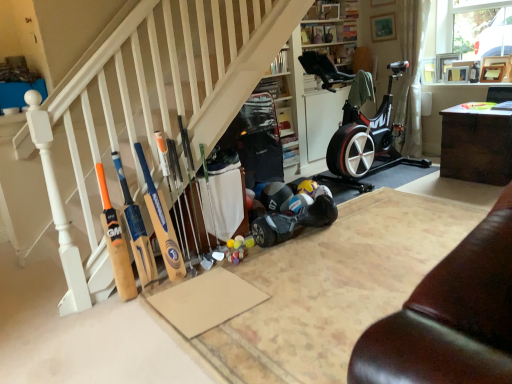
Question: Is dark wood table at right bigger or smaller than wooden cricket bats at lower left?

Choices:
 (A) big
 (B) small

Answer: (B)

Question: From a real-world perspective, is dark wood table at right physically located above or below wooden cricket bats at lower left?

Choices:
 (A) above
 (B) below

Answer: (B)

Question: Which object is the farthest from the wooden baseball bat at center, marked as the 3th baseball bat in a left-to-right arrangement?

Choices:
 (A) dark wood table at right
 (B) wooden baseball bat at left, the second baseball bat positioned from the left
 (C) wooden cricket bats at lower left
 (D) wooden bat at left, the 3th baseball bat viewed from the right

Answer: (A)

Question: Which of these objects is positioned farthest from the wooden baseball bat at center, arranged as the first baseball bat when viewed from the right?

Choices:
 (A) wooden bat at left, the 3th baseball bat viewed from the right
 (B) wooden cricket bats at lower left
 (C) wooden baseball bat at left, positioned as the second baseball bat in right-to-left order
 (D) dark wood table at right

Answer: (D)